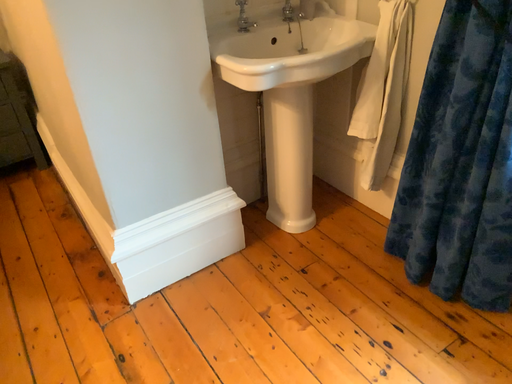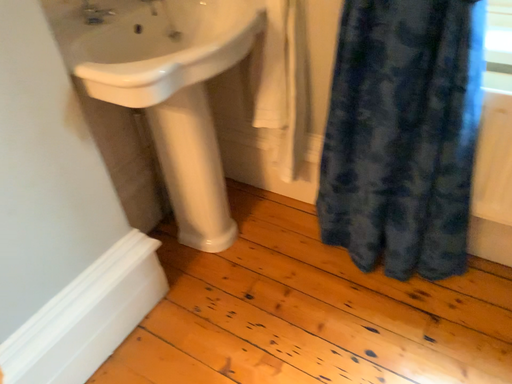
Question: Which way did the camera rotate in the video?

Choices:
 (A) rotated left
 (B) rotated right

Answer: (B)